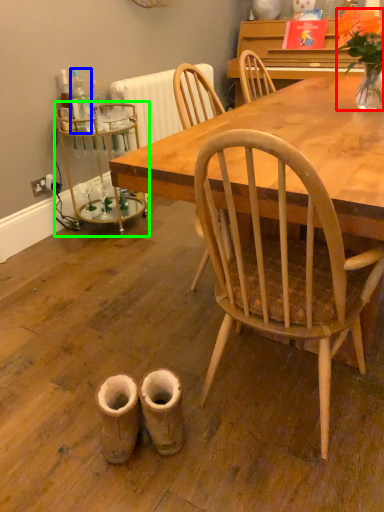
Question: Which is nearer to the houseplant (highlighted by a red box)? bottle (highlighted by a blue box) or side table (highlighted by a green box).

Choices:
 (A) bottle
 (B) side table

Answer: (A)